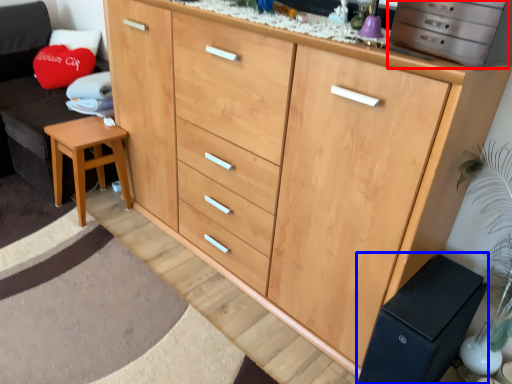
Question: Which object is further to the camera taking this photo, cabinetry (highlighted by a red box) or changing table (highlighted by a blue box)?

Choices:
 (A) cabinetry
 (B) changing table

Answer: (B)